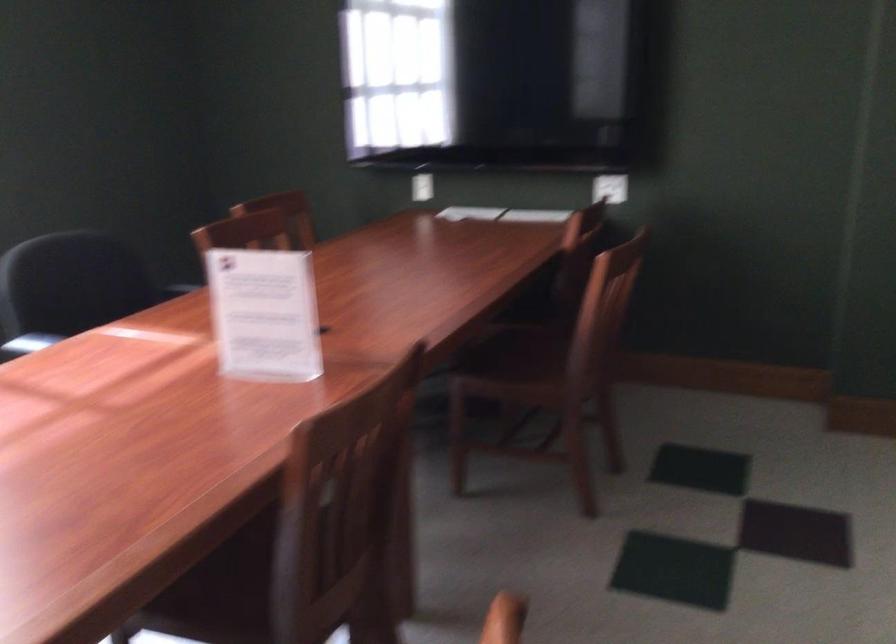
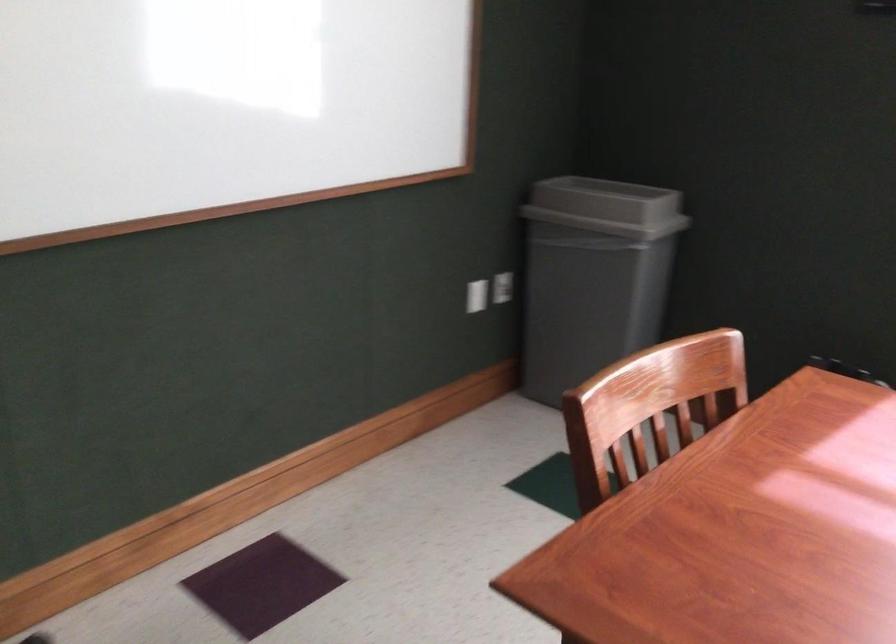
The images are taken continuously from a first-person perspective. In which direction is your viewpoint rotating?

The camera's rotation is toward left-down.